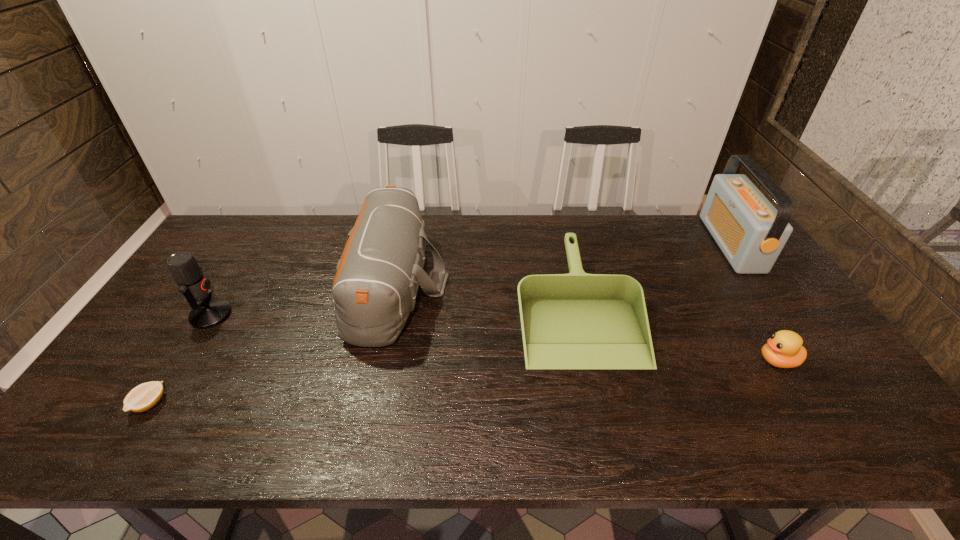
What are the coordinates of `microphone located in the left edge section of the desktop` in the screenshot? It's located at (185, 270).

The width and height of the screenshot is (960, 540). What are the coordinates of `lemon located at the left edge` in the screenshot? It's located at (144, 396).

At what (x,y) coordinates should I click in order to perform the action: click on radio receiver at the right edge. Please return your answer as a coordinate pair (x, y). Image resolution: width=960 pixels, height=540 pixels. Looking at the image, I should click on (751, 233).

The height and width of the screenshot is (540, 960). In order to click on duckling located in the right edge section of the desktop in this screenshot , I will do `click(784, 349)`.

Where is `object at the near left corner`? The width and height of the screenshot is (960, 540). object at the near left corner is located at coordinates (144, 396).

Find the location of a particular element. The width and height of the screenshot is (960, 540). object present at the far right corner is located at coordinates (751, 233).

Identify the location of free location at the far edge. (618, 224).

This screenshot has height=540, width=960. I want to click on vacant point at the near edge, so click(628, 427).

At what (x,y) coordinates should I click in order to perform the action: click on blank space at the left edge of the desktop. Please return your answer as a coordinate pair (x, y). This screenshot has width=960, height=540. Looking at the image, I should click on (162, 363).

In the image, there is a desktop. Identify the location of free region at the right edge. (747, 284).